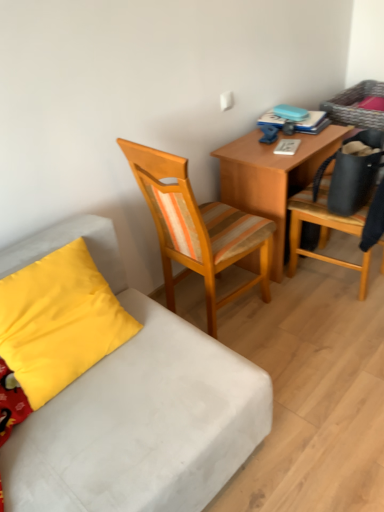
Where is `free space below wooden chair at right, the second chair viewed from the left (from a real-world perspective)`? free space below wooden chair at right, the second chair viewed from the left (from a real-world perspective) is located at coordinates (340, 280).